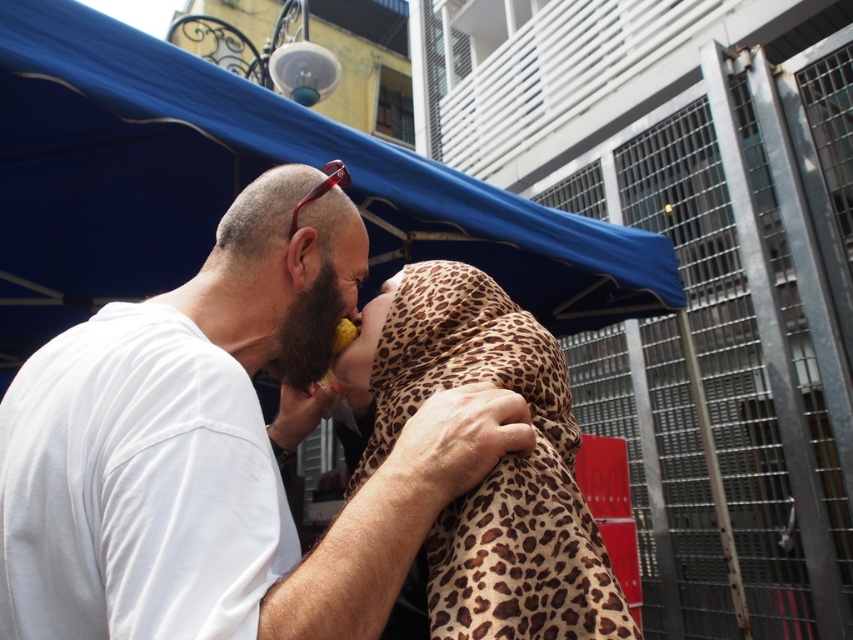
Question: Does white matte shirt at center appear on the left side of blue fabric canopy at upper center?

Choices:
 (A) yes
 (B) no

Answer: (A)

Question: Is white matte shirt at center above blue fabric canopy at upper center?

Choices:
 (A) no
 (B) yes

Answer: (A)

Question: From the image, what is the correct spatial relationship of white matte shirt at center in relation to blue fabric canopy at upper center?

Choices:
 (A) left
 (B) right

Answer: (A)